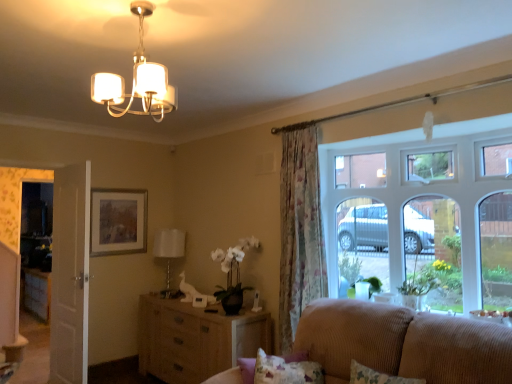
The height and width of the screenshot is (384, 512). What are the coordinates of `blank space above wooden picture frame at upper left (from a real-world perspective)` in the screenshot? It's located at (122, 184).